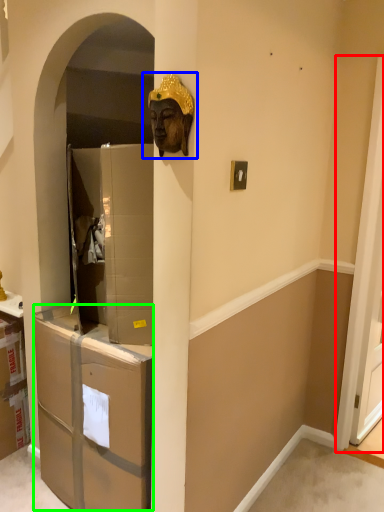
Question: Which is nearer to the screen door (highlighted by a red box)? bronze statue (highlighted by a blue box) or drawer (highlighted by a green box).

Choices:
 (A) bronze statue
 (B) drawer

Answer: (B)